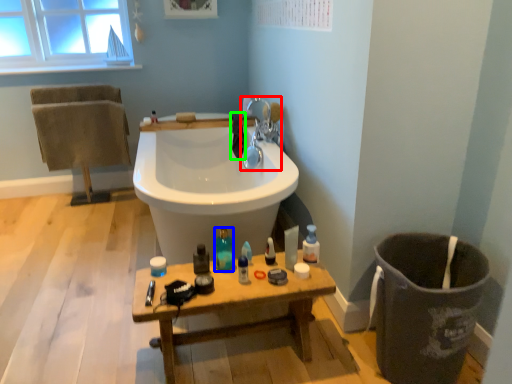
Question: Which object is the farthest from tap (highlighted by a red box)? Choose among these: toiletry (highlighted by a blue box) or bath towel (highlighted by a green box).

Choices:
 (A) toiletry
 (B) bath towel

Answer: (A)